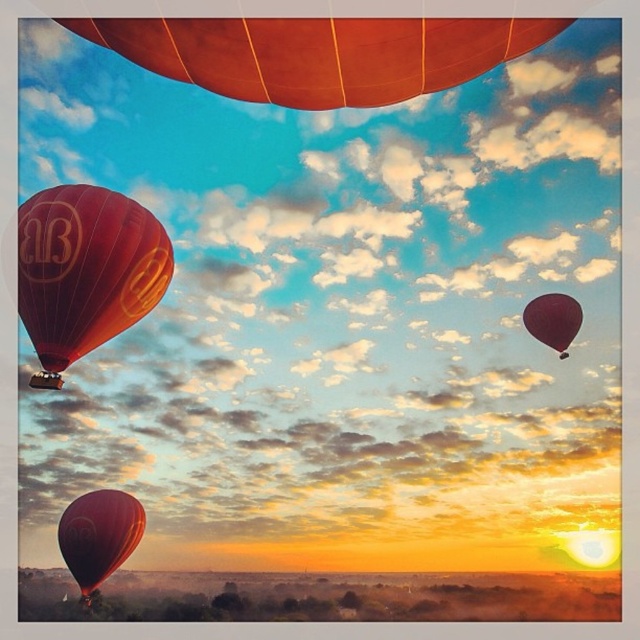
What do you see at coordinates (317, 52) in the screenshot? The image size is (640, 640). I see `matte orange balloon at upper center` at bounding box center [317, 52].

Is matte orange balloon at upper center further to camera compared to matte red hot air balloon at lower left?

That is False.

Does point (170, 35) lie behind point (115, 515)?

No, it is not.

Image resolution: width=640 pixels, height=640 pixels. In order to click on matte orange balloon at upper center in this screenshot , I will do `click(317, 52)`.

Between matte orange balloon at upper center and matte dark red balloon at upper right, which one appears on the right side from the viewer's perspective?

matte dark red balloon at upper right

This screenshot has width=640, height=640. What do you see at coordinates (317, 52) in the screenshot?
I see `matte orange balloon at upper center` at bounding box center [317, 52].

Where is `matte orange balloon at upper center`? This screenshot has width=640, height=640. matte orange balloon at upper center is located at coordinates (317, 52).

Does matte red hot air balloon at left have a larger size compared to matte red hot air balloon at lower left?

Incorrect, matte red hot air balloon at left is not larger than matte red hot air balloon at lower left.

Who is more forward, [92,330] or [65,532]?

Point [92,330] is in front.

I want to click on matte red hot air balloon at left, so click(84, 272).